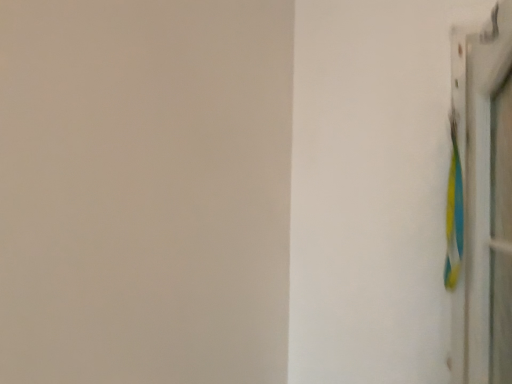
This screenshot has width=512, height=384. Describe the element at coordinates (454, 212) in the screenshot. I see `yellow-green plastic toothbrush at right` at that location.

Locate an element on the screen. yellow-green plastic toothbrush at right is located at coordinates (454, 212).

Find the location of a particular element. Image resolution: width=512 pixels, height=384 pixels. yellow-green plastic toothbrush at right is located at coordinates click(454, 212).